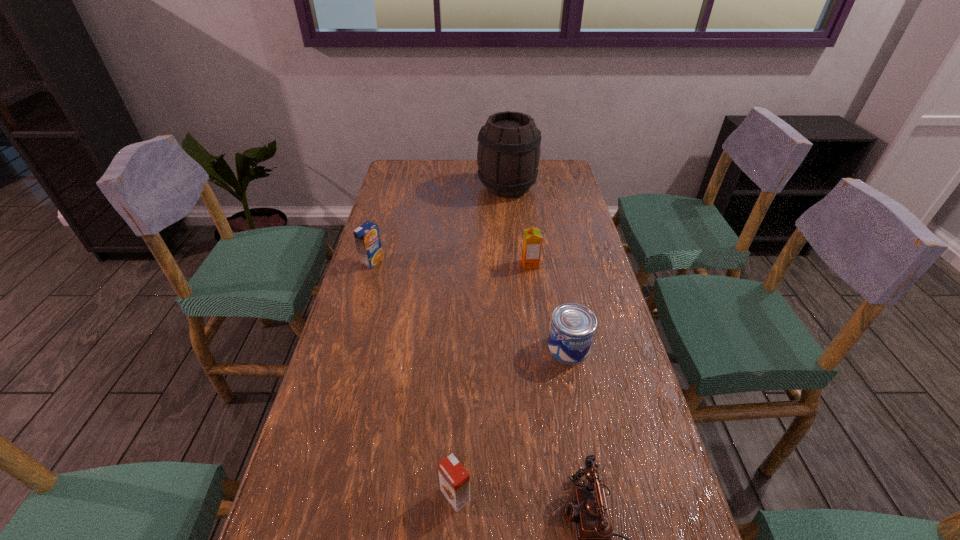
This screenshot has height=540, width=960. Identify the location of the farthest object. (508, 154).

Identify the location of wine bucket. This screenshot has width=960, height=540. (508, 154).

Where is `the rightmost orange juice`? the rightmost orange juice is located at coordinates (532, 239).

Locate an element on the screen. This screenshot has height=540, width=960. the leftmost object is located at coordinates (367, 237).

At what (x,y) coordinates should I click in order to perform the action: click on the fourth farthest object. Please return your answer as a coordinate pair (x, y). Looking at the image, I should click on (572, 329).

Identify the location of the second object from left to right. pos(454,480).

Locate an element on the screen. This screenshot has height=540, width=960. the shortest orange juice is located at coordinates (454, 480).

The width and height of the screenshot is (960, 540). I want to click on vacant space located on the front of the tallest object, so click(x=513, y=244).

Identify the location of vacant region located 0.360m on the left of the rightmost orange juice. This screenshot has height=540, width=960. (406, 264).

Locate an element on the screen. This screenshot has height=540, width=960. blank space located on the back of the leftmost orange juice is located at coordinates (382, 227).